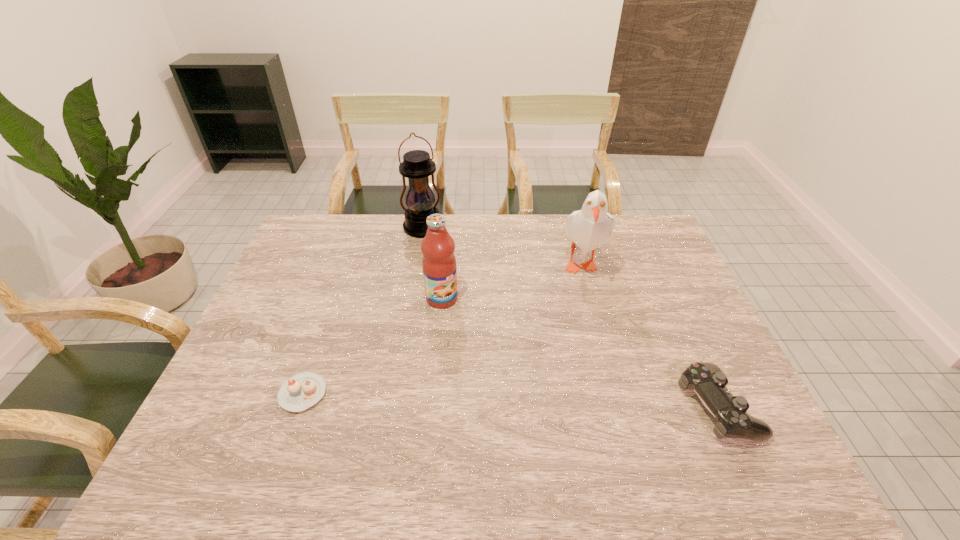
Where is `free space located on the front label of the fruit juice`? The image size is (960, 540). free space located on the front label of the fruit juice is located at coordinates (484, 346).

Find the location of a particular element. The height and width of the screenshot is (540, 960). blank area located 0.330m on the front label of the fruit juice is located at coordinates (521, 388).

In order to click on vacant space located 0.390m at the beak of the gull in this screenshot , I will do `click(497, 378)`.

The width and height of the screenshot is (960, 540). In order to click on free spot located 0.170m at the beak of the gull in this screenshot , I will do `click(543, 325)`.

Image resolution: width=960 pixels, height=540 pixels. Find the location of `free space located at the beak of the gull`. free space located at the beak of the gull is located at coordinates pyautogui.click(x=502, y=373).

Find several locations within the vacant space located above the lantern, indicating its light source. Please provide its 2D coordinates. Your answer should be formatted as a tuple, i.e. [(x, y)], where the tuple contains the x and y coordinates of a point satisfying the conditions above.

[(453, 292)]

Find a few locations in the blank space located above the lantern, indicating its light source. Please provide its 2D coordinates. Your answer should be formatted as a tuple, i.e. [(x, y)], where the tuple contains the x and y coordinates of a point satisfying the conditions above.

[(433, 249)]

Pinpoint the vacant space located above the lantern, indicating its light source. Please provide its 2D coordinates. Your answer should be formatted as a tuple, i.e. [(x, y)], where the tuple contains the x and y coordinates of a point satisfying the conditions above.

[(441, 266)]

Locate an element on the screen. Image resolution: width=960 pixels, height=540 pixels. gull located at the far edge is located at coordinates (589, 228).

This screenshot has height=540, width=960. I want to click on lantern at the far edge, so click(x=417, y=166).